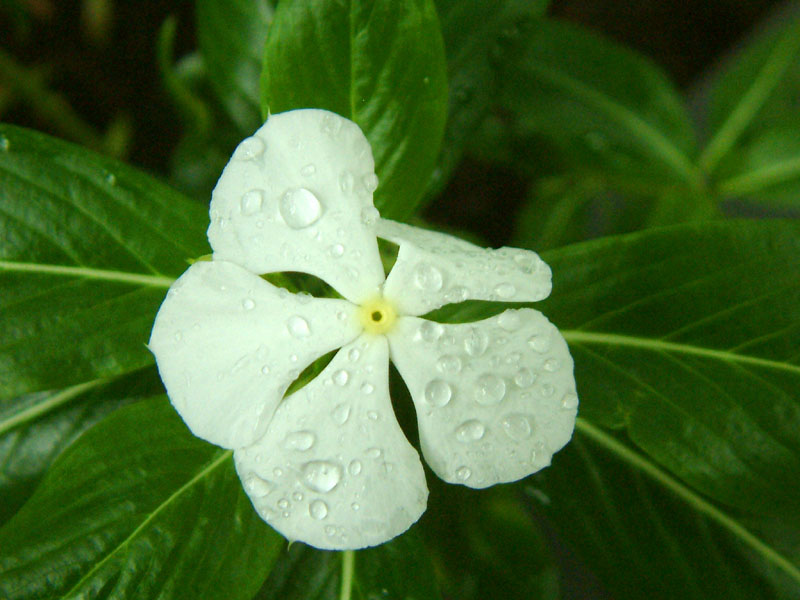
Locate an element on the screen. plant leaves is located at coordinates (346, 50), (46, 210), (708, 300), (198, 497), (593, 76), (586, 218), (769, 103), (784, 191).